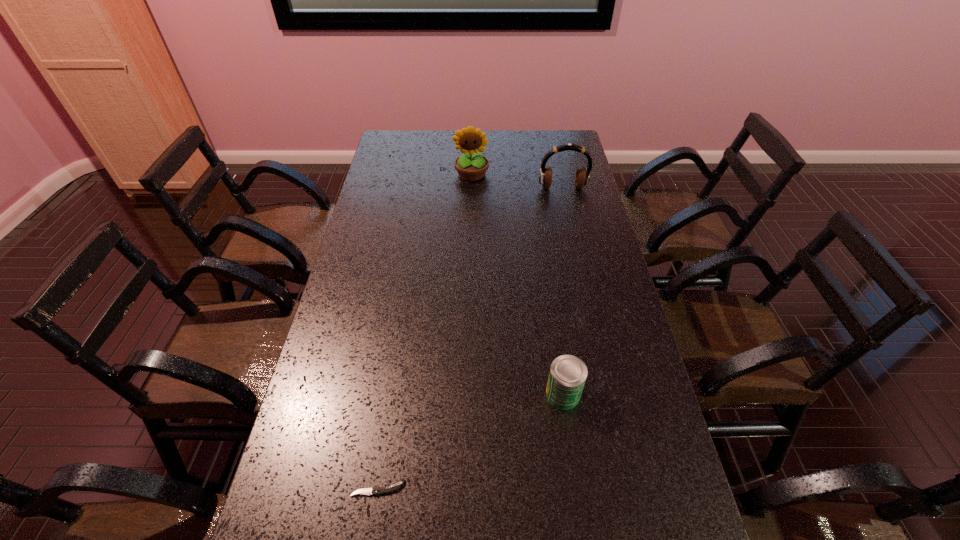
Locate an element on the screen. Image resolution: width=960 pixels, height=540 pixels. the second object from left to right is located at coordinates (471, 166).

In order to click on headset in this screenshot , I will do click(582, 177).

I want to click on can, so 568,373.

Locate an element on the screen. This screenshot has height=540, width=960. the third tallest object is located at coordinates (568, 373).

Find the location of `the nearest object`. the nearest object is located at coordinates (375, 490).

Identify the location of the shortest object. (375, 490).

In order to click on vacant space located 0.070m on the face of the second object from left to right in this screenshot , I will do `click(471, 194)`.

Find the location of `vacant area located 0.050m on the ear cup of the headset`. vacant area located 0.050m on the ear cup of the headset is located at coordinates (565, 200).

Locate an element on the screen. The height and width of the screenshot is (540, 960). vacant space positioned on the front of the second nearest object is located at coordinates (577, 490).

The height and width of the screenshot is (540, 960). Identify the location of vacant space located on the back of the shortest object. (396, 364).